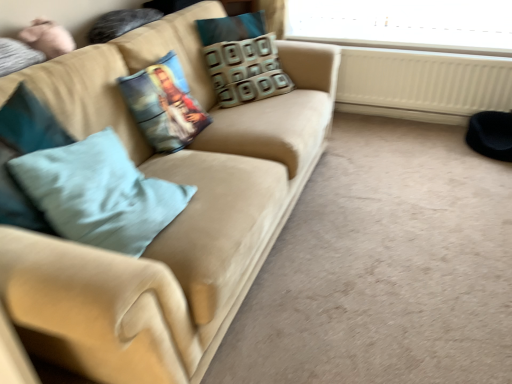
The height and width of the screenshot is (384, 512). What do you see at coordinates (99, 193) in the screenshot? I see `light blue fabric pillow at left` at bounding box center [99, 193].

Locate an element on the screen. The image size is (512, 384). suede beige couch at center is located at coordinates (176, 218).

What is the approximate height of printed fabric pillow at center, the second pillow in the back-to-front sequence?

15.00 inches.

The height and width of the screenshot is (384, 512). Find the location of `light blue fabric pillow at left`. light blue fabric pillow at left is located at coordinates (99, 193).

Is patterned fabric pillow at center, the 1th pillow from the right, at the back of white plastic radiator at lower right?

That's not correct — white plastic radiator at lower right is not looking away from patterned fabric pillow at center, the 1th pillow from the right.

Considering their positions, is white plastic radiator at lower right located in front of or behind patterned fabric pillow at center, marked as the 2th pillow in a front-to-back arrangement?

Visually, white plastic radiator at lower right is located behind patterned fabric pillow at center, marked as the 2th pillow in a front-to-back arrangement.

In the image, there is a patterned fabric pillow at center, acting as the second pillow starting from the left. At what (x,y) coordinates should I click in order to perform the action: click on radiator above it (from the image's perspective). Please return your answer as a coordinate pair (x, y). Looking at the image, I should click on coord(422,84).

I want to click on the 1st pillow behind the light blue fabric pillow at left, starting your count from the anchor, so click(x=164, y=105).

Measure the distance from light blue fabric pillow at left to printed fabric pillow at center, marked as the 1th pillow in a front-to-back arrangement.

light blue fabric pillow at left is 20.46 inches from printed fabric pillow at center, marked as the 1th pillow in a front-to-back arrangement.

Is light blue fabric pillow at left thinner than printed fabric pillow at center, marked as the 1th pillow in a front-to-back arrangement?

No.

Considering the sizes of objects light blue fabric pillow at left and printed fabric pillow at center, marked as the 1th pillow in a front-to-back arrangement, in the image provided, who is shorter, light blue fabric pillow at left or printed fabric pillow at center, marked as the 1th pillow in a front-to-back arrangement,?

light blue fabric pillow at left is shorter.

Considering the points (358, 66) and (124, 200), which point is in front, point (358, 66) or point (124, 200)?

The point (124, 200) is in front.

Is white plastic radiator at lower right inside or outside of light blue fabric pillow at left?

white plastic radiator at lower right cannot be found inside light blue fabric pillow at left.

Considering the relative positions of white plastic radiator at lower right and light blue fabric pillow at left in the image provided, is white plastic radiator at lower right to the left of light blue fabric pillow at left from the viewer's perspective?

No, white plastic radiator at lower right is not to the left of light blue fabric pillow at left.

Does white plastic radiator at lower right have a greater height compared to light blue fabric pillow at left?

Correct, white plastic radiator at lower right is much taller as light blue fabric pillow at left.

Measure the distance between suede beige couch at center and printed fabric pillow at center, which appears as the second pillow when viewed from the right.

suede beige couch at center is 12.70 inches from printed fabric pillow at center, which appears as the second pillow when viewed from the right.

Can you see suede beige couch at center touching printed fabric pillow at center, which appears as the second pillow when viewed from the right?

suede beige couch at center and printed fabric pillow at center, which appears as the second pillow when viewed from the right, are not in contact.

Choose the correct answer: Is suede beige couch at center inside printed fabric pillow at center, marked as the 1th pillow in a front-to-back arrangement, or outside it?

suede beige couch at center is spatially situated outside printed fabric pillow at center, marked as the 1th pillow in a front-to-back arrangement.

Is suede beige couch at center oriented towards printed fabric pillow at center, which appears as the second pillow when viewed from the right?

Yes, suede beige couch at center is turned towards printed fabric pillow at center, which appears as the second pillow when viewed from the right.

In the scene shown: Considering the sizes of objects printed fabric pillow at center, which appears as the second pillow when viewed from the right, and light blue fabric pillow at left in the image provided, who is smaller, printed fabric pillow at center, which appears as the second pillow when viewed from the right, or light blue fabric pillow at left?

printed fabric pillow at center, which appears as the second pillow when viewed from the right, is smaller.

Based on the photo, between printed fabric pillow at center, marked as the 1th pillow in a front-to-back arrangement, and light blue fabric pillow at left, which one has less height?

With less height is light blue fabric pillow at left.

Does printed fabric pillow at center, placed as the 1th pillow when sorted from left to right, come behind light blue fabric pillow at left?

Yes, printed fabric pillow at center, placed as the 1th pillow when sorted from left to right, is further from the camera.

Considering the sizes of objects printed fabric pillow at center, the second pillow in the back-to-front sequence, and light blue fabric pillow at left in the image provided, who is wider, printed fabric pillow at center, the second pillow in the back-to-front sequence, or light blue fabric pillow at left?

Wider between the two is light blue fabric pillow at left.

Which is in front, point (121, 162) or point (418, 86)?

Positioned in front is point (121, 162).

Which object is closer to the camera, light blue fabric pillow at left or white plastic radiator at lower right?

light blue fabric pillow at left is more forward.

Is the surface of light blue fabric pillow at left in direct contact with white plastic radiator at lower right?

No, light blue fabric pillow at left is not with white plastic radiator at lower right.

Between white plastic radiator at lower right and printed fabric pillow at center, the second pillow in the back-to-front sequence, which one has larger width?

Wider between the two is printed fabric pillow at center, the second pillow in the back-to-front sequence.

Is white plastic radiator at lower right far away from printed fabric pillow at center, which appears as the second pillow when viewed from the right?

That's right, there is a large distance between white plastic radiator at lower right and printed fabric pillow at center, which appears as the second pillow when viewed from the right.

Which of these two, white plastic radiator at lower right or printed fabric pillow at center, which appears as the second pillow when viewed from the right, is smaller?

With smaller size is printed fabric pillow at center, which appears as the second pillow when viewed from the right.

How many degrees apart are the facing directions of white plastic radiator at lower right and printed fabric pillow at center, marked as the 1th pillow in a front-to-back arrangement?

They differ by 89.8 degrees in their facing directions.

Locate an element on the screen. The image size is (512, 384). radiator that is above the patterned fabric pillow at center, acting as the second pillow starting from the left (from the image's perspective) is located at coordinates tap(422, 84).

Locate an element on the screen. The height and width of the screenshot is (384, 512). throw pillow below the printed fabric pillow at center, which appears as the second pillow when viewed from the right (from a real-world perspective) is located at coordinates (99, 193).

When comparing their distances from printed fabric pillow at center, marked as the 1th pillow in a front-to-back arrangement, does white plastic radiator at lower right or patterned fabric pillow at center, which is counted as the 1th pillow, starting from the back, seem closer?

Among the two, patterned fabric pillow at center, which is counted as the 1th pillow, starting from the back, is located nearer to printed fabric pillow at center, marked as the 1th pillow in a front-to-back arrangement.

Looking at the image, which one is located closer to white plastic radiator at lower right, printed fabric pillow at center, marked as the 1th pillow in a front-to-back arrangement, or light blue fabric pillow at left?

printed fabric pillow at center, marked as the 1th pillow in a front-to-back arrangement, lies closer to white plastic radiator at lower right than the other object.

From the image, which object appears to be nearer to printed fabric pillow at center, placed as the 1th pillow when sorted from left to right, patterned fabric pillow at center, marked as the 2th pillow in a front-to-back arrangement, or light blue fabric pillow at left?

patterned fabric pillow at center, marked as the 2th pillow in a front-to-back arrangement, is closer to printed fabric pillow at center, placed as the 1th pillow when sorted from left to right.

Based on their spatial positions, is patterned fabric pillow at center, marked as the 2th pillow in a front-to-back arrangement, or white plastic radiator at lower right further from suede beige couch at center?

Based on the image, white plastic radiator at lower right appears to be further to suede beige couch at center.

Based on their spatial positions, is printed fabric pillow at center, placed as the 1th pillow when sorted from left to right, or white plastic radiator at lower right closer to patterned fabric pillow at center, which is counted as the 1th pillow, starting from the back?

printed fabric pillow at center, placed as the 1th pillow when sorted from left to right, is positioned closer to the anchor patterned fabric pillow at center, which is counted as the 1th pillow, starting from the back.

Based on their spatial positions, is printed fabric pillow at center, marked as the 1th pillow in a front-to-back arrangement, or suede beige couch at center further from white plastic radiator at lower right?

Based on the image, printed fabric pillow at center, marked as the 1th pillow in a front-to-back arrangement, appears to be further to white plastic radiator at lower right.

Considering their positions, is patterned fabric pillow at center, which is counted as the 1th pillow, starting from the back, positioned further to white plastic radiator at lower right than printed fabric pillow at center, the second pillow in the back-to-front sequence?

printed fabric pillow at center, the second pillow in the back-to-front sequence, lies further to white plastic radiator at lower right than the other object.

Considering their positions, is white plastic radiator at lower right positioned further to suede beige couch at center than printed fabric pillow at center, placed as the 1th pillow when sorted from left to right?

Among the two, white plastic radiator at lower right is located further to suede beige couch at center.

Where is `throw pillow between suede beige couch at center and printed fabric pillow at center, the second pillow in the back-to-front sequence, from front to back`? The width and height of the screenshot is (512, 384). throw pillow between suede beige couch at center and printed fabric pillow at center, the second pillow in the back-to-front sequence, from front to back is located at coordinates (99, 193).

Find the location of a particular element. The width and height of the screenshot is (512, 384). pillow between printed fabric pillow at center, marked as the 1th pillow in a front-to-back arrangement, and white plastic radiator at lower right, in the horizontal direction is located at coordinates (242, 59).

At what (x,y) coordinates should I click in order to perform the action: click on pillow between light blue fabric pillow at left and patterned fabric pillow at center, the 1th pillow from the right, along the z-axis. Please return your answer as a coordinate pair (x, y). This screenshot has width=512, height=384. Looking at the image, I should click on (164, 105).

Where is `throw pillow located between suede beige couch at center and white plastic radiator at lower right in the depth direction`? Image resolution: width=512 pixels, height=384 pixels. throw pillow located between suede beige couch at center and white plastic radiator at lower right in the depth direction is located at coordinates (99, 193).